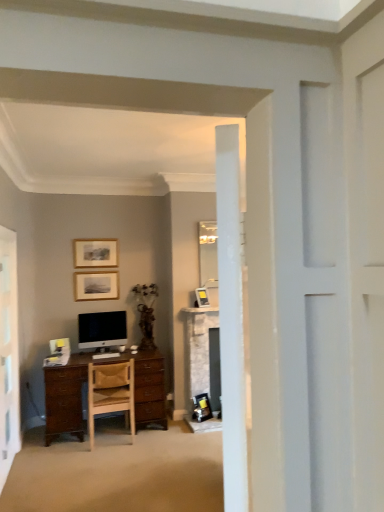
The width and height of the screenshot is (384, 512). Find the location of `wooden picture frame at upper center, the third picture frame viewed from the right`. wooden picture frame at upper center, the third picture frame viewed from the right is located at coordinates pyautogui.click(x=95, y=253).

Measure the distance between point (x=15, y=401) and camera.

The depth of point (x=15, y=401) is 3.70 meters.

Find the location of `white glossy screen door at left`. white glossy screen door at left is located at coordinates (8, 354).

This screenshot has width=384, height=512. What do you see at coordinates (96, 285) in the screenshot? I see `matte gold picture frame at upper center, acting as the second picture frame starting from the right` at bounding box center [96, 285].

Image resolution: width=384 pixels, height=512 pixels. I want to click on matte gold picture frame at upper center, which ranks as the second picture frame in bottom-to-top order, so click(x=96, y=285).

Identify the location of wooden chair at center. The width and height of the screenshot is (384, 512). (110, 392).

Identify the location of wooden picture frame at upper center, the first picture frame from the top. This screenshot has width=384, height=512. (95, 253).

Is point (1, 317) positioned after point (206, 305)?

No, it is in front of (206, 305).

Looking at this image, is white glossy screen door at left not within matte silver picture frame at center, which ranks as the 1th picture frame in right-to-left order?

Yes, white glossy screen door at left is not within matte silver picture frame at center, which ranks as the 1th picture frame in right-to-left order.

From the image's perspective, which is above, white glossy screen door at left or matte silver picture frame at center, acting as the first picture frame starting from the bottom?

matte silver picture frame at center, acting as the first picture frame starting from the bottom.

Considering the sizes of white glossy screen door at left and matte silver picture frame at center, which is the third picture frame in top-to-bottom order, in the image, is white glossy screen door at left taller or shorter than matte silver picture frame at center, which is the third picture frame in top-to-bottom order,?

Clearly, white glossy screen door at left is taller compared to matte silver picture frame at center, which is the third picture frame in top-to-bottom order.

From the image's perspective, between wooden picture frame at upper center, the third picture frame viewed from the right, and satin black monitor at center, who is located below?

satin black monitor at center.

Are wooden picture frame at upper center, the first picture frame from the top, and satin black monitor at center making contact?

No, wooden picture frame at upper center, the first picture frame from the top, is not beside satin black monitor at center.

From a real-world perspective, which object rests below the other?

satin black monitor at center.

How many degrees apart are the facing directions of satin black monitor at center and matte gold picture frame at upper center, acting as the second picture frame starting from the left?

The angle between the facing direction of satin black monitor at center and the facing direction of matte gold picture frame at upper center, acting as the second picture frame starting from the left, is 0.491 degrees.

Locate an element on the screen. The height and width of the screenshot is (512, 384). television that appears below the matte gold picture frame at upper center, acting as the second picture frame starting from the left (from the image's perspective) is located at coordinates (102, 329).

Considering the relative sizes of satin black monitor at center and matte gold picture frame at upper center, which appears as the 2th picture frame when viewed from the top, in the image provided, is satin black monitor at center bigger than matte gold picture frame at upper center, which appears as the 2th picture frame when viewed from the top,?

Correct, satin black monitor at center is larger in size than matte gold picture frame at upper center, which appears as the 2th picture frame when viewed from the top.

Is satin black monitor at center at the right side of matte gold picture frame at upper center, which appears as the 2th picture frame when viewed from the top?

Yes.

From the image's perspective, is satin black monitor at center beneath wooden picture frame at upper center, the third picture frame viewed from the right?

Yes, from the image's perspective, satin black monitor at center is below wooden picture frame at upper center, the third picture frame viewed from the right.

Based on their sizes in the image, would you say satin black monitor at center is bigger or smaller than wooden picture frame at upper center, the third picture frame viewed from the right?

Clearly, satin black monitor at center is larger in size than wooden picture frame at upper center, the third picture frame viewed from the right.

Which is closer, (117, 330) or (83, 259)?

The point (117, 330) is more forward.

Considering the positions of objects satin black monitor at center and wooden picture frame at upper center, the first picture frame from the top, in the image provided, who is more to the right, satin black monitor at center or wooden picture frame at upper center, the first picture frame from the top,?

satin black monitor at center is more to the right.

Do you think satin black monitor at center is within matte silver picture frame at center, arranged as the third picture frame when viewed from the left, or outside of it?

satin black monitor at center is not inside matte silver picture frame at center, arranged as the third picture frame when viewed from the left, it's outside.

From a real-world perspective, does satin black monitor at center sit lower than matte silver picture frame at center, which ranks as the 1th picture frame in right-to-left order?

Correct, in the physical world, satin black monitor at center is lower than matte silver picture frame at center, which ranks as the 1th picture frame in right-to-left order.

Is point (110, 325) closer or farther from the camera than point (202, 302)?

Point (110, 325) appears to be farther away from the viewer than point (202, 302).

Between satin black monitor at center and matte silver picture frame at center, arranged as the third picture frame when viewed from the left, which one appears on the right side from the viewer's perspective?

From the viewer's perspective, matte silver picture frame at center, arranged as the third picture frame when viewed from the left, appears more on the right side.

Consider the image. Is wooden picture frame at upper center, the 3th picture frame from the bottom, to the right of wooden chair at center from the viewer's perspective?

Incorrect, wooden picture frame at upper center, the 3th picture frame from the bottom, is not on the right side of wooden chair at center.

How different are the orientations of wooden picture frame at upper center, the third picture frame viewed from the right, and wooden chair at center in degrees?

179 degrees.

Is wooden picture frame at upper center, the first picture frame from the top, facing away from wooden chair at center?

No, wooden picture frame at upper center, the first picture frame from the top, is not facing away from wooden chair at center.

Does point (97, 244) come farther from viewer compared to point (89, 393)?

Yes, point (97, 244) is farther from viewer.

Looking at this image, is white glossy screen door at left at the back of satin black monitor at center?

Answer: That's not correct — satin black monitor at center is not looking away from white glossy screen door at left.

From a real-world perspective, is satin black monitor at center positioned under white glossy screen door at left based on gravity?

No, from a real-world perspective, satin black monitor at center is not beneath white glossy screen door at left.

From the image's perspective, would you say satin black monitor at center is positioned over white glossy screen door at left?

Indeed, from the image's perspective, satin black monitor at center is shown above white glossy screen door at left.

Does satin black monitor at center have a lesser width compared to white glossy screen door at left?

Incorrect, the width of satin black monitor at center is not less than that of white glossy screen door at left.

You are a GUI agent. You are given a task and a screenshot of the screen. Output one action in this format:
    pyautogui.click(x=<x>, y=<y>)
    Task: Click on the screen door to the left of matte silver picture frame at center, acting as the first picture frame starting from the bottom
    
    Given the screenshot: What is the action you would take?
    pyautogui.click(x=8, y=354)

Locate an element on the screen. This screenshot has width=384, height=512. television on the right of wooden picture frame at upper center, the first picture frame when ordered from left to right is located at coordinates (102, 329).

When comparing their distances from matte silver picture frame at center, which is the third picture frame in top-to-bottom order, does matte gold picture frame at upper center, which ranks as the second picture frame in bottom-to-top order, or wooden chair at center seem further?

Among the two, wooden chair at center is located further to matte silver picture frame at center, which is the third picture frame in top-to-bottom order.

Considering their positions, is satin black monitor at center positioned further to matte gold picture frame at upper center, acting as the second picture frame starting from the left, than wooden chair at center?

The object further to matte gold picture frame at upper center, acting as the second picture frame starting from the left, is wooden chair at center.

Which object lies further to the anchor point satin black monitor at center, matte gold picture frame at upper center, acting as the second picture frame starting from the right, or matte silver picture frame at center, which ranks as the 1th picture frame in right-to-left order?

Among the two, matte silver picture frame at center, which ranks as the 1th picture frame in right-to-left order, is located further to satin black monitor at center.

When comparing their distances from wooden chair at center, does white glossy screen door at left or satin black monitor at center seem further?

white glossy screen door at left.

Based on their spatial positions, is wooden picture frame at upper center, the first picture frame when ordered from left to right, or wooden chair at center closer to satin black monitor at center?

wooden picture frame at upper center, the first picture frame when ordered from left to right, lies closer to satin black monitor at center than the other object.

Consider the image. Considering their positions, is white glossy screen door at left positioned closer to wooden chair at center than matte gold picture frame at upper center, which appears as the 2th picture frame when viewed from the top?

white glossy screen door at left lies closer to wooden chair at center than the other object.

From the image, which object appears to be nearer to wooden chair at center, wooden picture frame at upper center, the first picture frame from the top, or white glossy screen door at left?

Among the two, white glossy screen door at left is located nearer to wooden chair at center.

Which object lies further to the anchor point wooden chair at center, satin black monitor at center or white glossy screen door at left?

white glossy screen door at left lies further to wooden chair at center than the other object.

The height and width of the screenshot is (512, 384). In order to click on chair between matte gold picture frame at upper center, acting as the second picture frame starting from the left, and matte silver picture frame at center, which ranks as the 1th picture frame in right-to-left order in this screenshot , I will do `click(110, 392)`.

Locate an element on the screen. television between white glossy screen door at left and matte gold picture frame at upper center, acting as the second picture frame starting from the right, from front to back is located at coordinates coord(102,329).

I want to click on television between matte gold picture frame at upper center, acting as the second picture frame starting from the left, and matte silver picture frame at center, which is the third picture frame in top-to-bottom order, in the horizontal direction, so click(102, 329).

Locate an element on the screen. This screenshot has width=384, height=512. television positioned between white glossy screen door at left and wooden picture frame at upper center, the first picture frame from the top, from near to far is located at coordinates (102, 329).